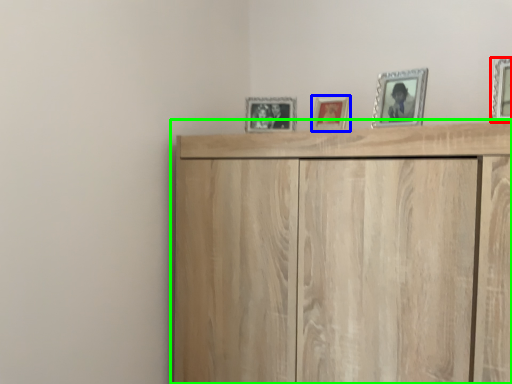
Question: Based on their relative distances, which object is farther from picture frame (highlighted by a red box)? Choose from picture frame (highlighted by a blue box) and cupboard (highlighted by a green box).

Choices:
 (A) picture frame
 (B) cupboard

Answer: (B)